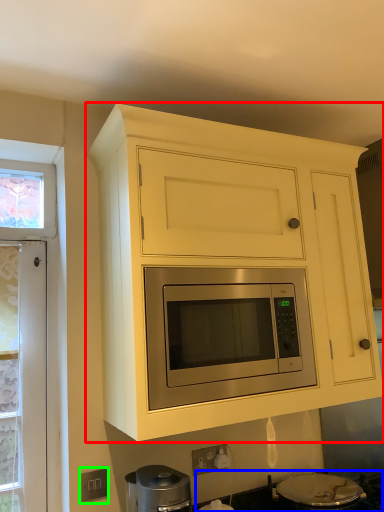
Question: Which object is the closest to the cabinetry (highlighted by a red box)? Choose among these: gas stove (highlighted by a blue box) or electric outlet (highlighted by a green box).

Choices:
 (A) gas stove
 (B) electric outlet

Answer: (A)